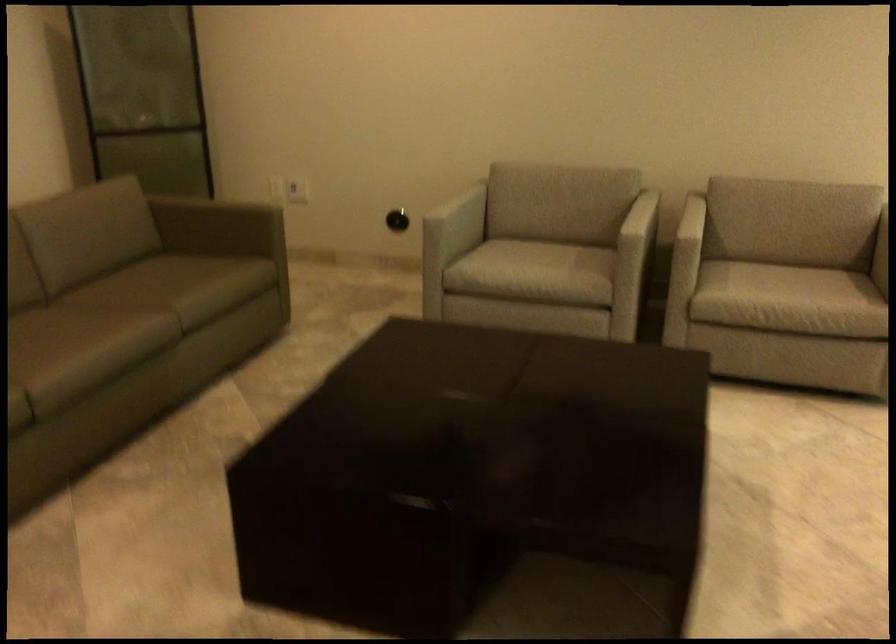
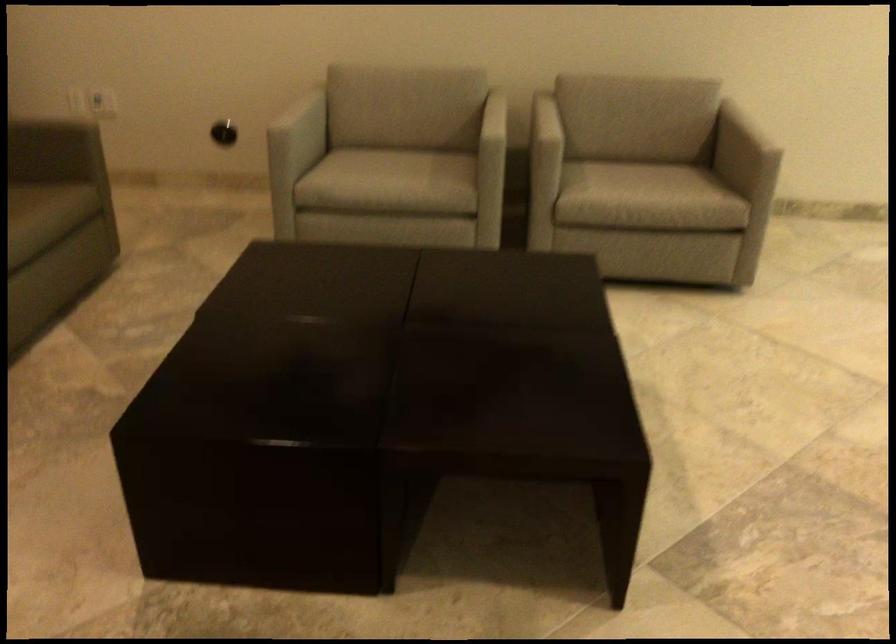
Find the pixel in the second image that matches (x=780, y=263) in the first image.

(633, 160)